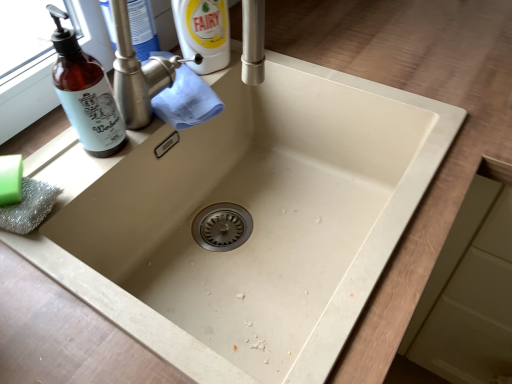
Where is `free space in front of brown glass bottle at left`? Image resolution: width=512 pixels, height=384 pixels. free space in front of brown glass bottle at left is located at coordinates (x=80, y=195).